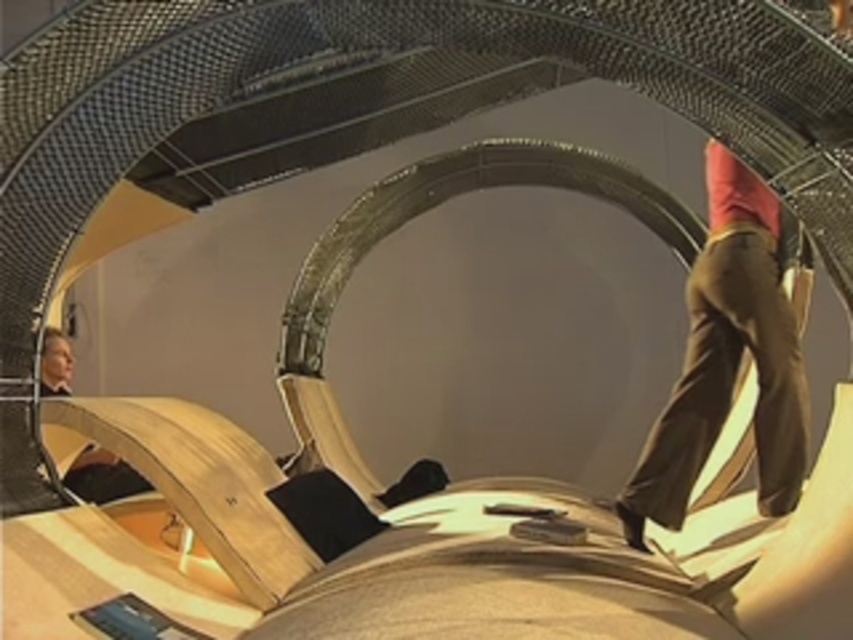
Does brown leather pants at right have a lesser height compared to smooth beige suit at lower left?

Incorrect, brown leather pants at right's height does not fall short of smooth beige suit at lower left's.

Who is more forward, (767, 189) or (68, 468)?

Point (767, 189)

Is point (723, 180) more distant than point (86, 497)?

No.

You are a GUI agent. You are given a task and a screenshot of the screen. Output one action in this format:
    pyautogui.click(x=<x>, y=<y>)
    Task: Click on the brown leather pants at right
    The image size is (853, 640).
    Given the screenshot: What is the action you would take?
    pyautogui.click(x=727, y=360)